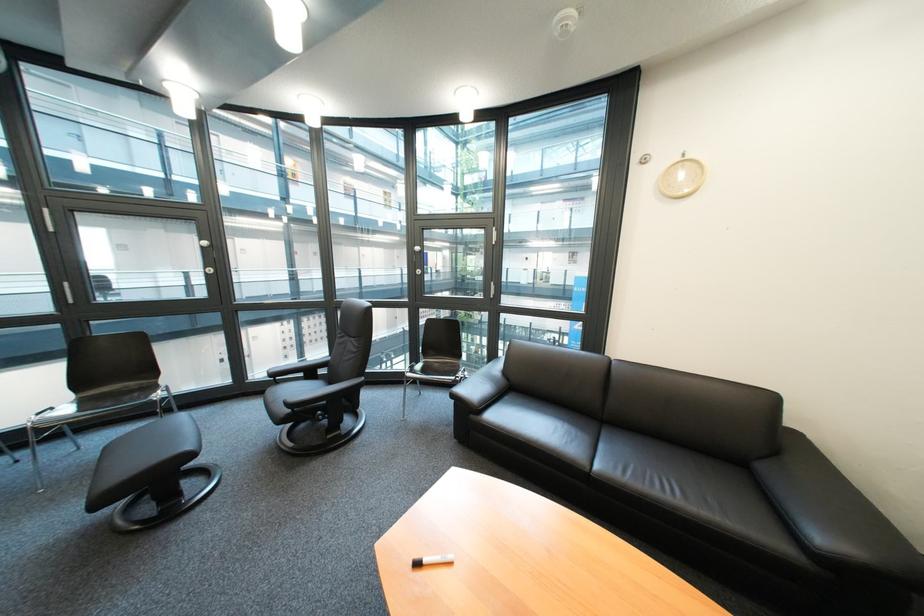
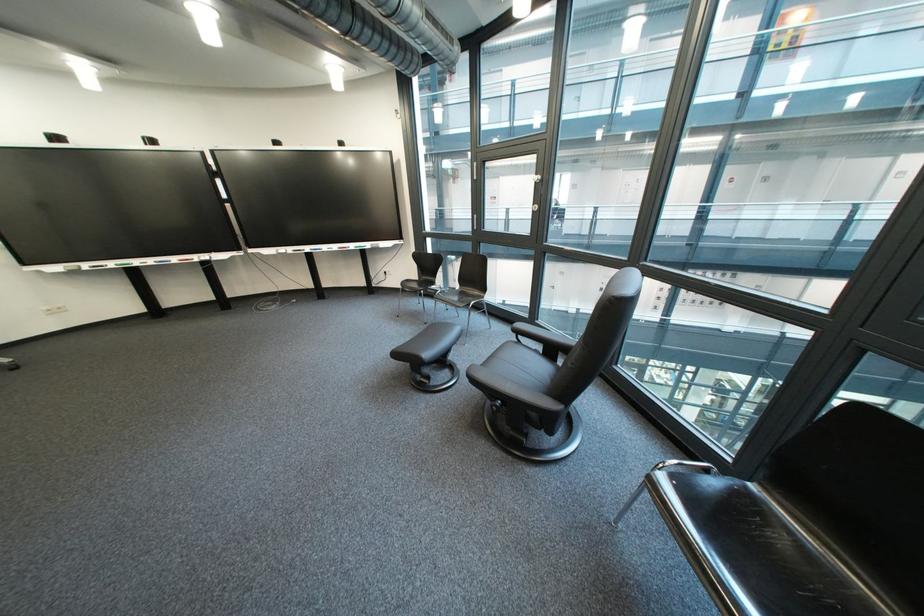
In the second image, find the point that corresponds to the point at 403,416 in the first image.

(622, 488)